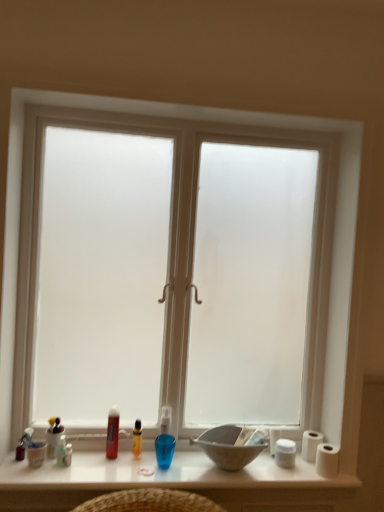
Identify the location of vacant space in front of translucent plastic bottle at center, arranged as the 1th toiletry when viewed from the right. The width and height of the screenshot is (384, 512). (130, 471).